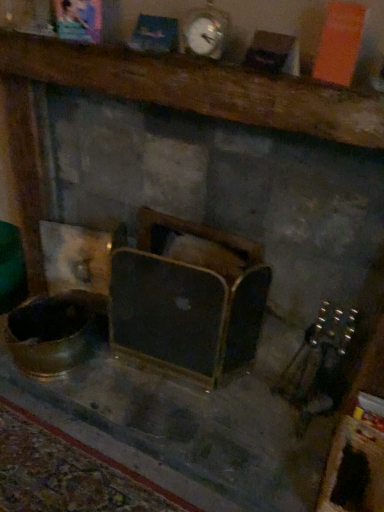
At what (x,y) coordinates should I click in order to perform the action: click on vacant space in front of metallic silver clock at upper center. Please return your answer as a coordinate pair (x, y). Looking at the image, I should click on (212, 64).